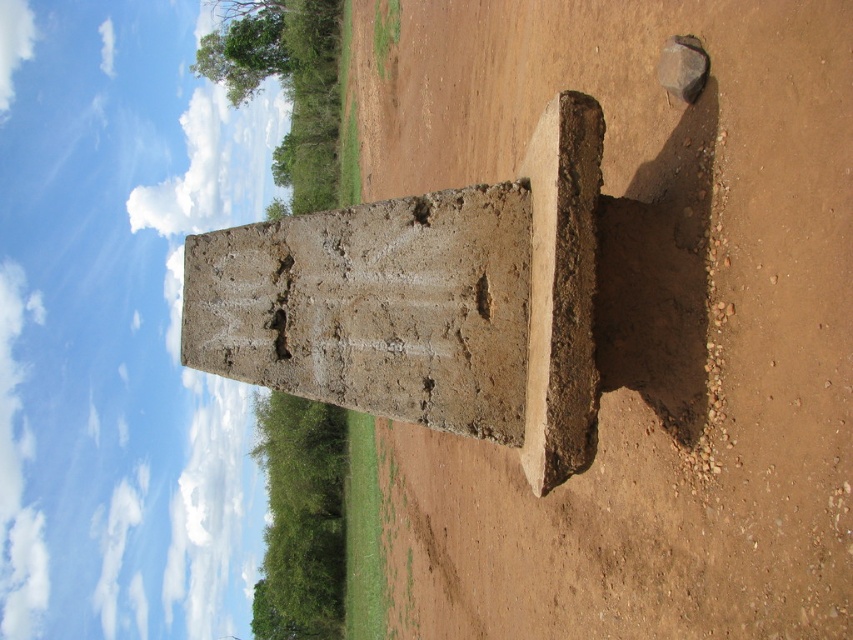
Question: Does brown dirt at center have a smaller size compared to gray concrete pillar at center?

Choices:
 (A) yes
 (B) no

Answer: (B)

Question: Can you confirm if brown dirt at center is bigger than gray concrete pillar at center?

Choices:
 (A) yes
 (B) no

Answer: (A)

Question: Which object appears farthest from the camera in this image?

Choices:
 (A) brown dirt at center
 (B) gray concrete pillar at center

Answer: (B)

Question: Where is brown dirt at center located in relation to gray concrete pillar at center in the image?

Choices:
 (A) left
 (B) right

Answer: (B)

Question: Which object appears farthest from the camera in this image?

Choices:
 (A) brown dirt at center
 (B) gray concrete pillar at center

Answer: (B)